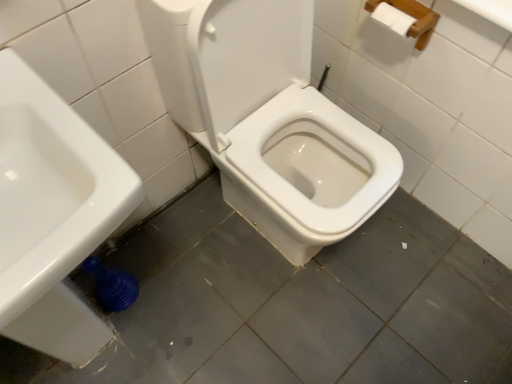
I want to click on vacant area that lies to the right of white glossy sink at lower left, so 237,302.